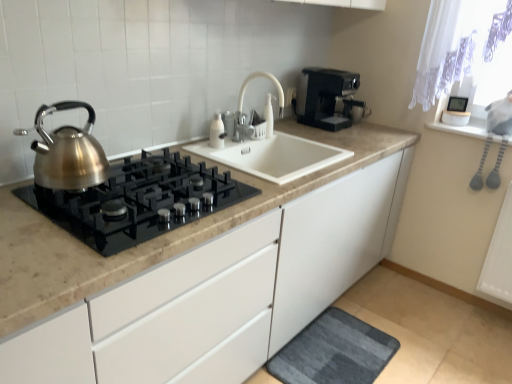
Question: Based on their sizes in the image, would you say satin metallic gas stove at left is bigger or smaller than black plastic coffee maker at upper right?

Choices:
 (A) big
 (B) small

Answer: (B)

Question: Is satin metallic gas stove at left to the left or to the right of black plastic coffee maker at upper right in the image?

Choices:
 (A) right
 (B) left

Answer: (B)

Question: Estimate the real-world distances between objects in this image. Which object is farther from the white matte faucet at center?

Choices:
 (A) satin metallic gas stove at left
 (B) dark gray textured bath mat at lower center
 (C) black plastic coffee maker at upper right
 (D) brushed metal kettle at left

Answer: (B)

Question: Based on their relative distances, which object is nearer to the dark gray textured bath mat at lower center?

Choices:
 (A) white matte faucet at center
 (B) brushed metal kettle at left
 (C) satin metallic gas stove at left
 (D) black plastic coffee maker at upper right

Answer: (C)